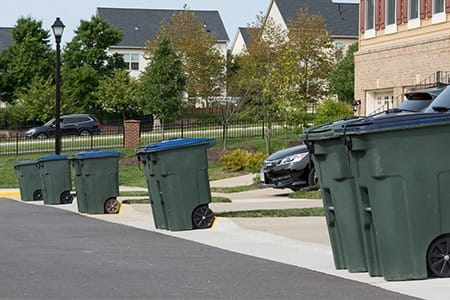
You are a GUI agent. You are given a task and a screenshot of the screen. Output one action in this format:
    pyautogui.click(x=<x>, y=<y>)
    Task: Click on the trash cans
    The width and height of the screenshot is (450, 300).
    Given the screenshot: What is the action you would take?
    pyautogui.click(x=27, y=184), pyautogui.click(x=54, y=177), pyautogui.click(x=79, y=186), pyautogui.click(x=89, y=185), pyautogui.click(x=163, y=192), pyautogui.click(x=154, y=194), pyautogui.click(x=342, y=211), pyautogui.click(x=397, y=204)